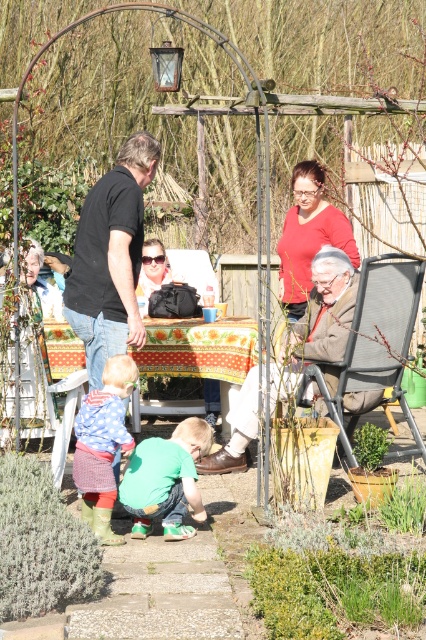
You are standing at the center of the garden and want to find the black matte shirt at left. Which direction should you move to locate it?

The black matte shirt at left is located at point [111,257], so you should move towards the left side of the garden to find it.

You are standing at the point marked as point (129, 339) in the garden. The table with the red and yellow tablecloth is located 6.86 meters away from you. Can you see the table clearly from your current position?

Yes, the table with the red and yellow tablecloth is located 6.86 meters away from point (129, 339), so you can see it clearly from that position.